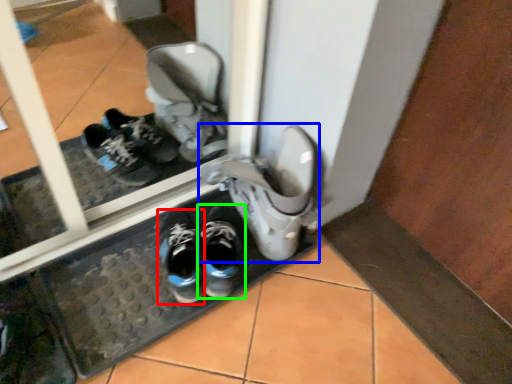
Question: Considering the real-world distances, which object is closest to running shoe (highlighted by a red box)? footwear (highlighted by a blue box) or footwear (highlighted by a green box).

Choices:
 (A) footwear
 (B) footwear

Answer: (B)